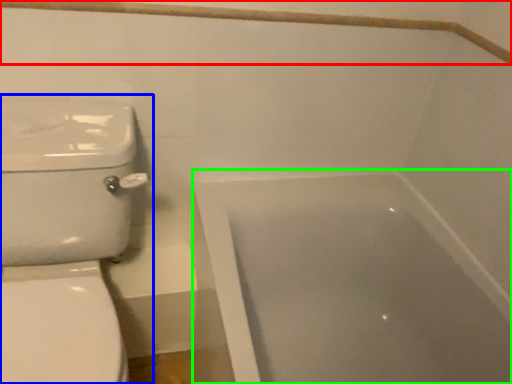
Question: Based on their relative distances, which object is nearer to balustrade (highlighted by a red box)? Choose from toilet (highlighted by a blue box) and bathtub (highlighted by a green box).

Choices:
 (A) toilet
 (B) bathtub

Answer: (A)